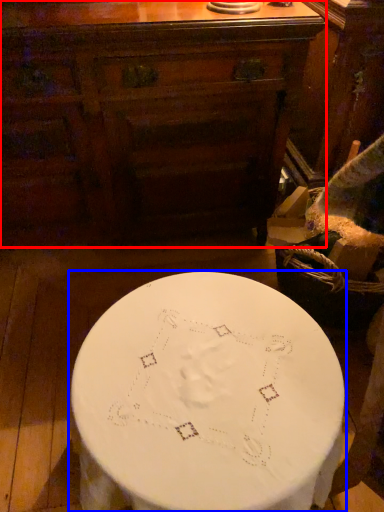
Question: Which object appears farthest to the camera in this image, chest of drawers (highlighted by a red box) or table (highlighted by a blue box)?

Choices:
 (A) chest of drawers
 (B) table

Answer: (A)